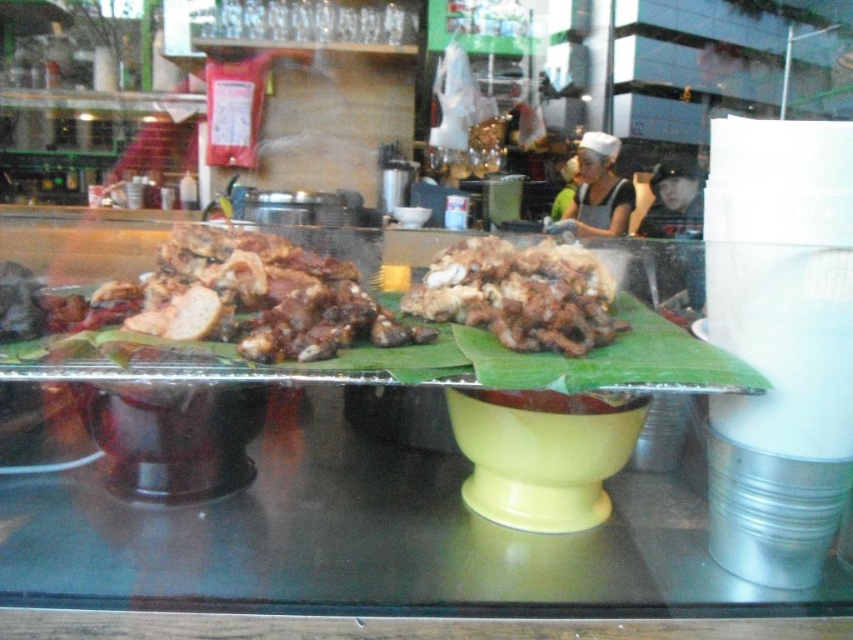
Question: Which of the following is the farthest from the observer?

Choices:
 (A) brown matte meat at center
 (B) brown crispy meat at center

Answer: (B)

Question: Does brown matte meat at center come behind brown crispy meat at center?

Choices:
 (A) no
 (B) yes

Answer: (A)

Question: Which of the following is the farthest from the observer?

Choices:
 (A) (215, 227)
 (B) (418, 300)

Answer: (A)

Question: Is brown matte meat at center smaller than brown crispy meat at center?

Choices:
 (A) yes
 (B) no

Answer: (B)

Question: Which of the following is the farthest from the observer?

Choices:
 (A) brown crispy meat at center
 (B) brown matte meat at center

Answer: (A)

Question: Is brown matte meat at center behind brown crispy meat at center?

Choices:
 (A) yes
 (B) no

Answer: (B)